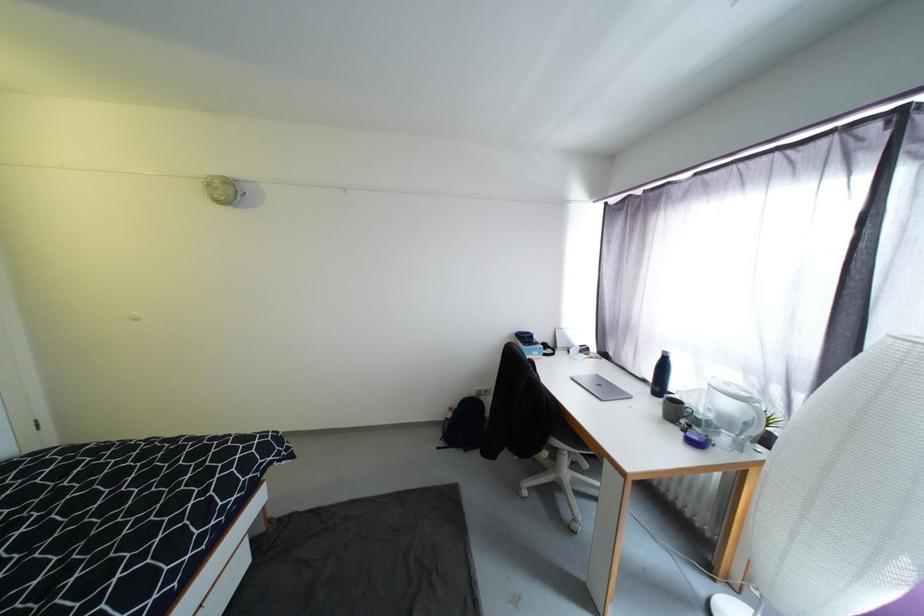
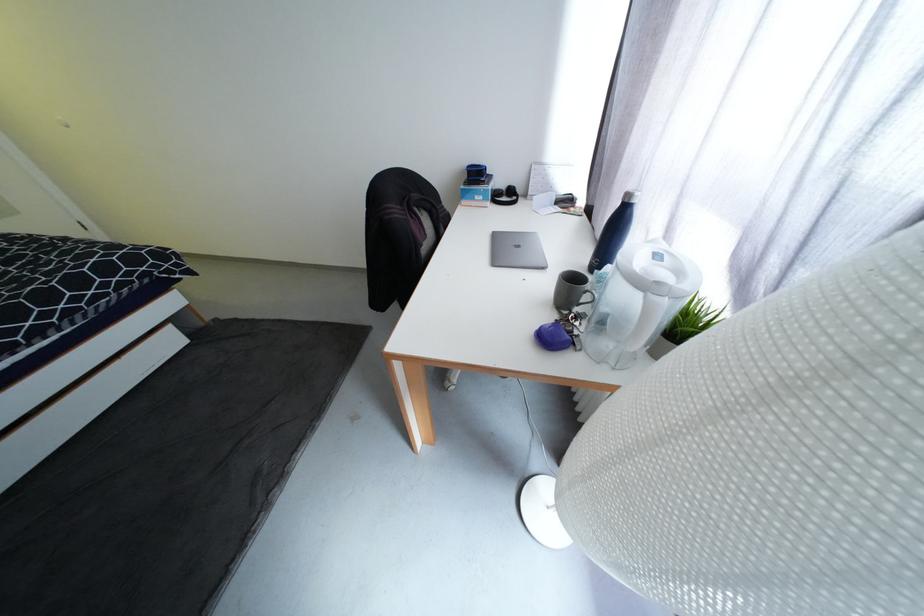
The point at (551,357) is marked in the first image. Where is the corresponding point in the second image?

(499, 203)